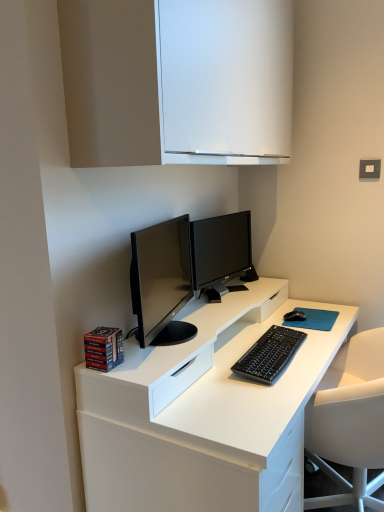
Identify the location of white matte cabinet at upper center. This screenshot has height=512, width=384. (177, 81).

The image size is (384, 512). I want to click on white glossy desk at center, so click(203, 413).

Measure the distance between black matte keyboard at center and camera.

1.28 meters.

Where is `black matte keyboard at center`? black matte keyboard at center is located at coordinates (269, 354).

The width and height of the screenshot is (384, 512). In order to click on white matte cabinet at upper center in this screenshot , I will do `click(177, 81)`.

Can you confirm if white glossy desk at center is shorter than white matte cabinet at upper center?

In fact, white glossy desk at center may be taller than white matte cabinet at upper center.

From the image's perspective, which one is positioned lower, white glossy desk at center or white matte cabinet at upper center?

white glossy desk at center is shown below in the image.

In the image, is white glossy desk at center positioned in front of or behind white matte cabinet at upper center?

Visually, white glossy desk at center is located behind white matte cabinet at upper center.

Where is `cabinetry located above the white glossy desk at center (from a real-world perspective)`? cabinetry located above the white glossy desk at center (from a real-world perspective) is located at coordinates (x=177, y=81).

Based on the photo, does white matte cabinet at upper center have a lesser width compared to white glossy desk at center?

Yes, white matte cabinet at upper center is thinner than white glossy desk at center.

Which is in front, point (158, 163) or point (248, 415)?

The point (158, 163) is closer to the camera.

What's the angular difference between white matte cabinet at upper center and white glossy desk at center's facing directions?

The facing directions of white matte cabinet at upper center and white glossy desk at center are 1.18 degrees apart.

Would you say black matte keyboard at center is inside or outside hardcover book at lower left?

black matte keyboard at center is not inside hardcover book at lower left, it's outside.

From a real-world perspective, is black matte keyboard at center on top of hardcover book at lower left?

No, from a real-world perspective, black matte keyboard at center is not over hardcover book at lower left

Is black matte keyboard at center oriented away from hardcover book at lower left?

No, black matte keyboard at center's orientation is not away from hardcover book at lower left.

Considering the relative sizes of black matte keyboard at center and white glossy desk at center in the image provided, is black matte keyboard at center thinner than white glossy desk at center?

Yes, black matte keyboard at center is thinner than white glossy desk at center.

From a real-world perspective, is black matte keyboard at center physically located above or below white glossy desk at center?

From a real-world perspective, black matte keyboard at center is physically above white glossy desk at center.

From the image's perspective, which one is positioned lower, black matte keyboard at center or white glossy desk at center?

white glossy desk at center appears lower in the image.

Considering the sizes of objects black matte keyboard at center and white glossy desk at center in the image provided, who is shorter, black matte keyboard at center or white glossy desk at center?

black matte keyboard at center.

From the picture: Is black matte keyboard at center facing away from black matte mouse at right?

That's not correct — black matte keyboard at center is not looking away from black matte mouse at right.

Between black matte keyboard at center and black matte mouse at right, which one is positioned behind?

black matte mouse at right is further away from the camera.

From the image's perspective, who appears lower, black matte mouse at right or white matte cabinet at upper center?

From the image's view, black matte mouse at right is below.

Are black matte mouse at right and white matte cabinet at upper center making contact?

No, black matte mouse at right is not making contact with white matte cabinet at upper center.

Does black matte mouse at right contain white matte cabinet at upper center?

No.

Is black matte mouse at right wider or thinner than white matte cabinet at upper center?

black matte mouse at right is thinner than white matte cabinet at upper center.

What's the angular difference between black matte mouse at right and hardcover book at lower left's facing directions?

20.7 degrees separate the facing orientations of black matte mouse at right and hardcover book at lower left.

From the image's perspective, does black matte mouse at right appear lower than hardcover book at lower left?

Actually, black matte mouse at right appears above hardcover book at lower left in the image.

Is point (283, 316) closer or farther from the camera than point (91, 344)?

Point (283, 316).

Would you say black matte mouse at right is inside or outside hardcover book at lower left?

black matte mouse at right is located beyond the bounds of hardcover book at lower left.

Find the location of a particular element. This screenshot has height=512, width=384. cabinetry above the white glossy desk at center (from a real-world perspective) is located at coordinates (177, 81).

Where is `desk below the white matte cabinet at upper center (from the image's perspective)`? This screenshot has width=384, height=512. desk below the white matte cabinet at upper center (from the image's perspective) is located at coordinates (203, 413).

Estimate the real-world distances between objects in this image. Which object is further from hardcover book at lower left, black matte keyboard at center or white glossy desk at center?

Based on the image, black matte keyboard at center appears to be further to hardcover book at lower left.

Consider the image. When comparing their distances from black matte keyboard at center, does hardcover book at lower left or white glossy desk at center seem further?

hardcover book at lower left is further to black matte keyboard at center.

When comparing their distances from black matte keyboard at center, does white glossy desk at center or black matte mouse at right seem closer?

white glossy desk at center is closer to black matte keyboard at center.

Considering their positions, is black matte keyboard at center positioned further to white glossy desk at center than satin black monitor at center?

satin black monitor at center is positioned further to the anchor white glossy desk at center.

Estimate the real-world distances between objects in this image. Which object is further from black matte mouse at right, white matte cabinet at upper center or satin black monitor at center?

white matte cabinet at upper center is further to black matte mouse at right.

When comparing their distances from black matte keyboard at center, does white matte cabinet at upper center or white glossy desk at center seem closer?

white glossy desk at center.

From the image, which object appears to be nearer to black matte keyboard at center, white glossy desk at center or white matte cabinet at upper center?

Based on the image, white glossy desk at center appears to be nearer to black matte keyboard at center.

Estimate the real-world distances between objects in this image. Which object is closer to white glossy desk at center, black matte mouse at right or satin black monitor at center?

satin black monitor at center lies closer to white glossy desk at center than the other object.

Find the location of a particular element. The image size is (384, 512). computer monitor between white matte cabinet at upper center and hardcover book at lower left vertically is located at coordinates (220, 249).

Identify the location of computer monitor between white glossy desk at center and black matte mouse at right from front to back. This screenshot has width=384, height=512. (220, 249).

At what (x,y) coordinates should I click in order to perform the action: click on computer keyboard between white glossy desk at center and black matte mouse at right along the z-axis. Please return your answer as a coordinate pair (x, y). The height and width of the screenshot is (512, 384). Looking at the image, I should click on (269, 354).

This screenshot has width=384, height=512. I want to click on desk between hardcover book at lower left and black matte keyboard at center in the horizontal direction, so click(203, 413).